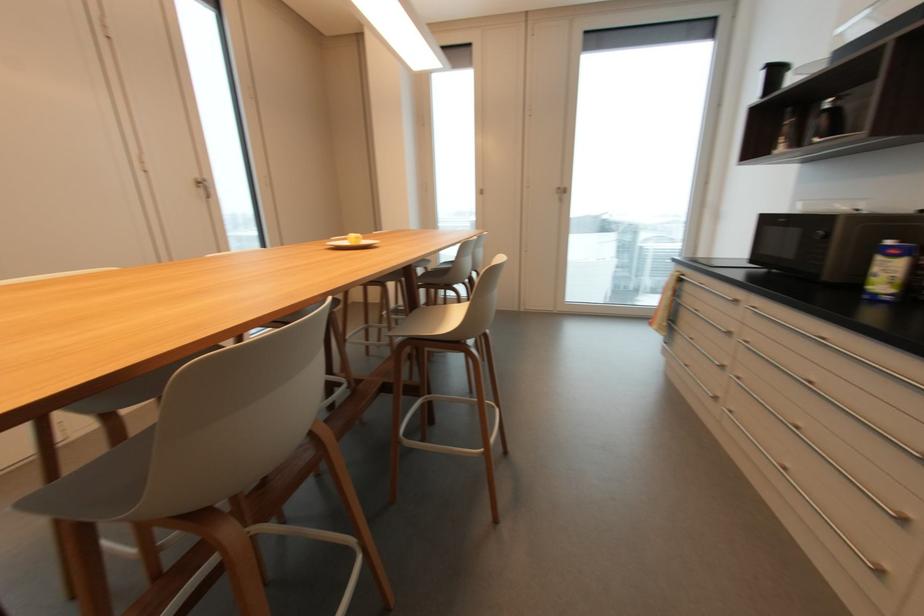
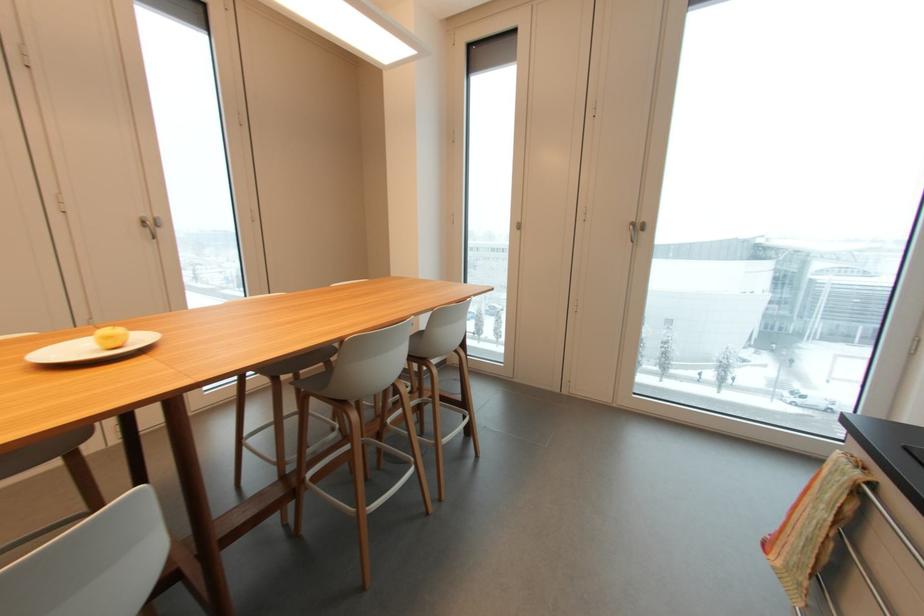
In a continuous first-person perspective shot, in which direction is the camera moving?

The movement direction of the cameraman is right, forward.